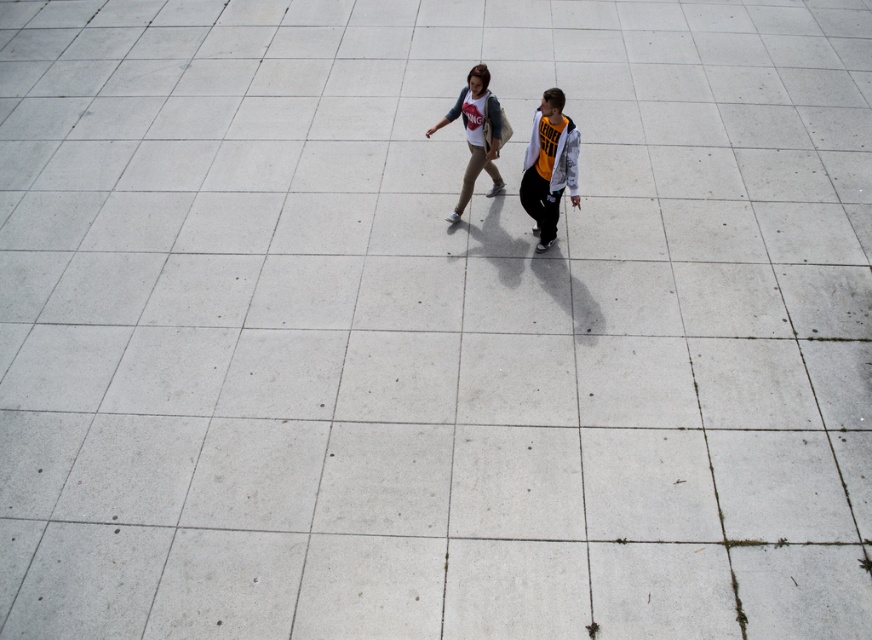
Question: Does orange jersey at center have a lesser width compared to matte white shirt at center?

Choices:
 (A) no
 (B) yes

Answer: (B)

Question: Which object appears closest to the camera in this image?

Choices:
 (A) orange jersey at center
 (B) matte white shirt at center

Answer: (A)

Question: Does orange jersey at center have a lesser width compared to matte white shirt at center?

Choices:
 (A) no
 (B) yes

Answer: (B)

Question: Among these objects, which one is farthest from the camera?

Choices:
 (A) matte white shirt at center
 (B) orange jersey at center

Answer: (A)

Question: Considering the relative positions of orange jersey at center and matte white shirt at center in the image provided, where is orange jersey at center located with respect to matte white shirt at center?

Choices:
 (A) right
 (B) left

Answer: (A)

Question: Which object appears closest to the camera in this image?

Choices:
 (A) matte white shirt at center
 (B) orange jersey at center

Answer: (B)